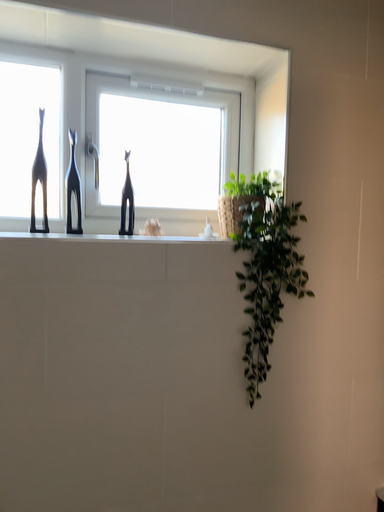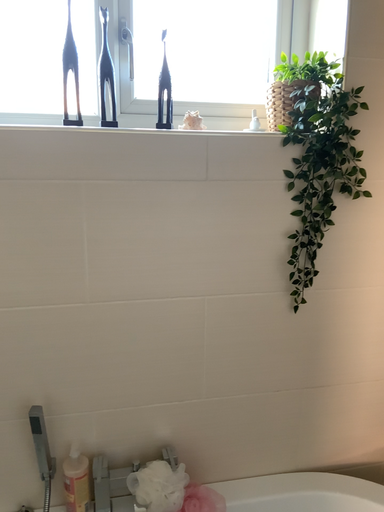
Question: How did the camera likely rotate when shooting the video?

Choices:
 (A) rotated upward
 (B) rotated downward

Answer: (B)